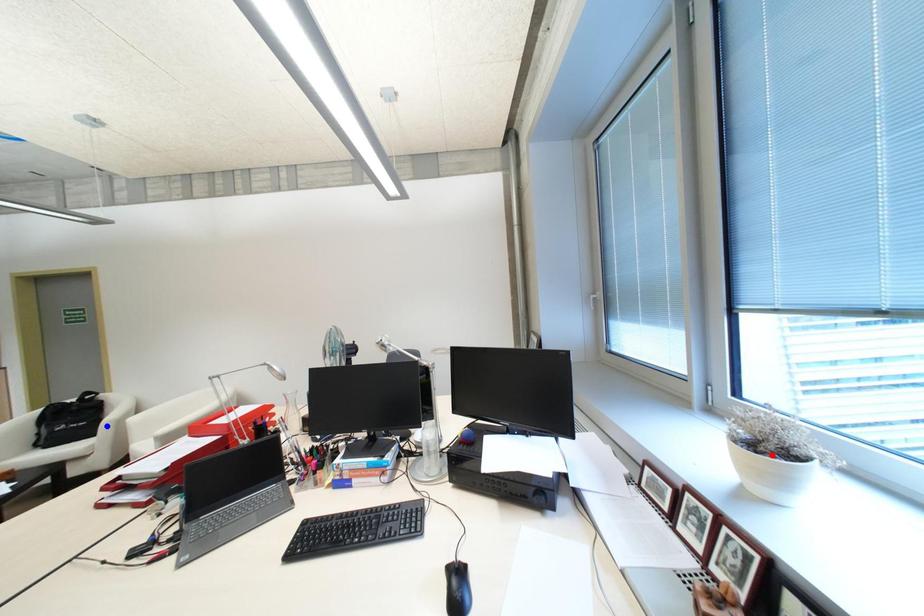
Question: Which of the two points in the image is closer to the camera?

Choices:
 (A) Blue point is closer.
 (B) Red point is closer.

Answer: (B)